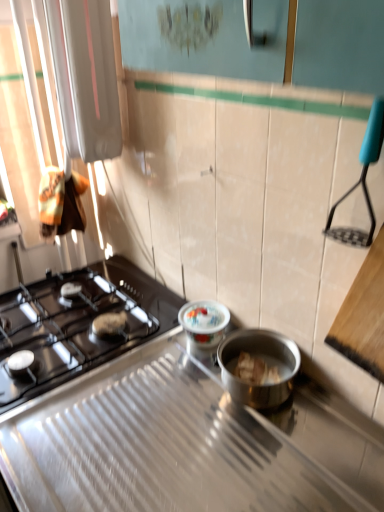
The image size is (384, 512). I want to click on unoccupied area in front of porcelain floral-patterned container at center, so click(x=167, y=400).